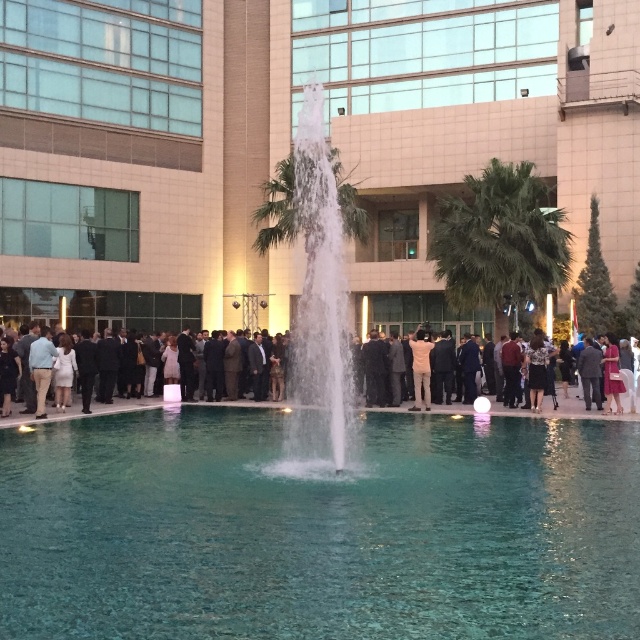
Question: Which point appears closest to the camera in this image?

Choices:
 (A) (212, 557)
 (B) (440, 56)

Answer: (A)

Question: Is transparent glass mall at center wider than white matte shirt at center?

Choices:
 (A) yes
 (B) no

Answer: (A)

Question: Is clear glass pool at center below clear glass fountain at center?

Choices:
 (A) yes
 (B) no

Answer: (A)

Question: Among these points, which one is farthest from the camera?

Choices:
 (A) (189, 212)
 (B) (298, 192)
 (C) (419, 392)
 (D) (125, 403)

Answer: (A)

Question: Estimate the real-world distances between objects in this image. Which object is farther from the clear glass fountain at center?

Choices:
 (A) white matte shirt at center
 (B) transparent glass mall at center
 (C) clear glass pool at center
 (D) formal attire group at center

Answer: (B)

Question: Does clear glass fountain at center have a lesser width compared to white matte shirt at center?

Choices:
 (A) yes
 (B) no

Answer: (B)